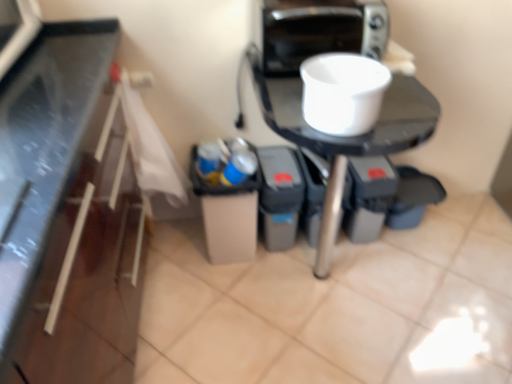
Question: Would you say white glossy table at center is to the left or to the right of blue plastic cup at center in the picture?

Choices:
 (A) right
 (B) left

Answer: (A)

Question: Does point (377, 104) appear closer or farther from the camera than point (237, 140)?

Choices:
 (A) farther
 (B) closer

Answer: (B)

Question: Based on their relative distances, which object is farther from the white matte bowl at upper center?

Choices:
 (A) blue plastic cup at center
 (B) white glossy table at center
 (C) metallic silver toaster at upper right

Answer: (A)

Question: Estimate the real-world distances between objects in this image. Which object is farther from the white glossy table at center?

Choices:
 (A) blue plastic cup at center
 (B) metallic silver toaster at upper right
 (C) white matte bowl at upper center

Answer: (A)